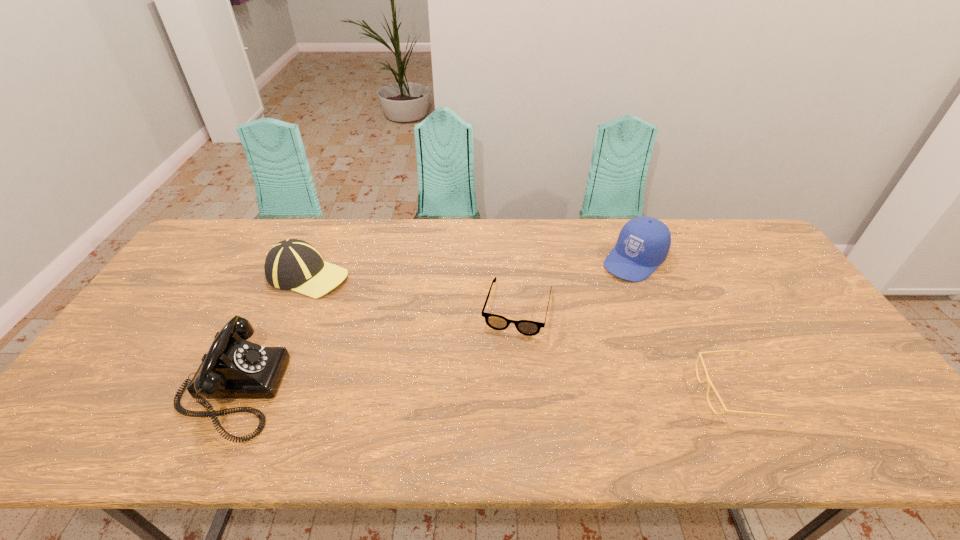
Locate which object is the closest to the cap. Please provide its 2D coordinates. Your answer should be formatted as a tuple, i.e. [(x, y)], where the tuple contains the x and y coordinates of a point satisfying the conditions above.

[(526, 327)]

In order to click on free point that satisfies the following two spatial constraints: 1. on the front side of the farther spectacles; 2. in front of the lenses of the nearer spectacles in this screenshot , I will do `click(524, 392)`.

Locate an element on the screen. vacant space that satisfies the following two spatial constraints: 1. on the front side of the nearer spectacles; 2. in front of the lenses of the baseball cap is located at coordinates [257, 392].

Where is `vacant area that satisfies the following two spatial constraints: 1. on the front side of the third tallest object; 2. in front of the lenses of the nearer spectacles`? vacant area that satisfies the following two spatial constraints: 1. on the front side of the third tallest object; 2. in front of the lenses of the nearer spectacles is located at coordinates point(257,392).